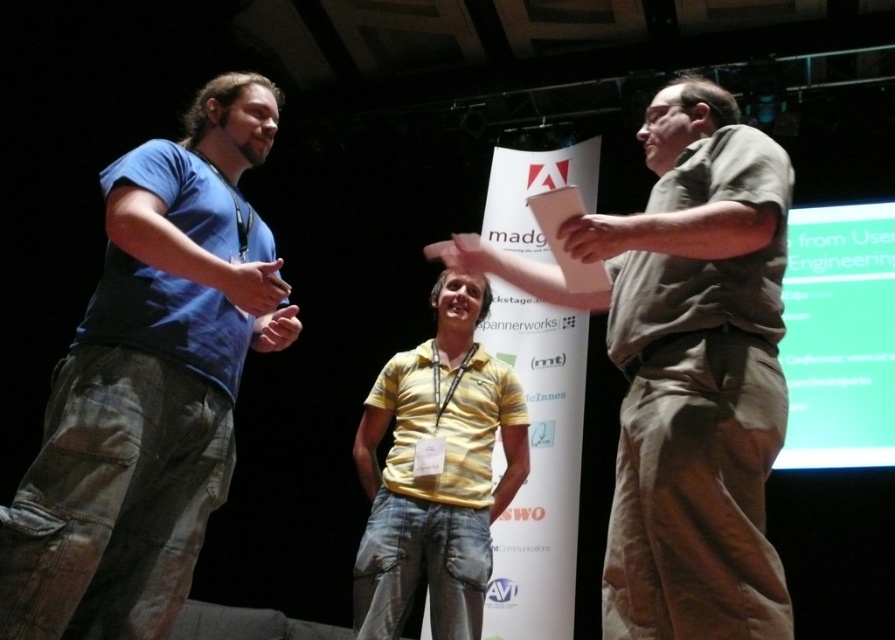
You are a photographer at an event and need to capture a clear photo of the blue cotton shirt at left. The camera you are using has a minimum focusing distance of 5 feet. Can you take the photo without moving closer?

The blue cotton shirt at left and camera are 5.36 feet apart from each other. Since the minimum focusing distance is 5 feet, the photographer can take the photo without moving closer as the distance is sufficient.

You are attending a formal event and need to locate the speaker. The blue cotton shirt at left and the matte brown shirt at center are both present. Based on their positions, which one is likely the speaker?

The blue cotton shirt at left is above matte brown shirt at center, indicating a higher position, so the blue cotton shirt at left is likely the speaker.